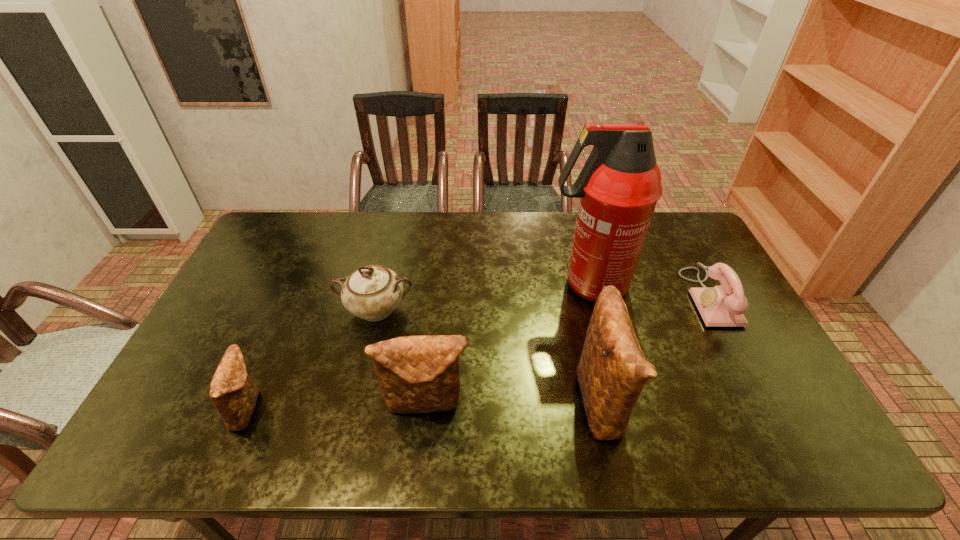
Image resolution: width=960 pixels, height=540 pixels. Find the location of `the leftmost clutch bag`. the leftmost clutch bag is located at coordinates (234, 394).

This screenshot has width=960, height=540. I want to click on the shortest clutch bag, so click(234, 394).

Find the location of a particular element. The width and height of the screenshot is (960, 540). the fourth shortest object is located at coordinates (417, 374).

In order to click on the second clutch bag from left to right in this screenshot , I will do point(417,374).

Where is `the rightmost clutch bag`? the rightmost clutch bag is located at coordinates (612, 371).

This screenshot has height=540, width=960. I want to click on the tallest object, so click(x=619, y=185).

The height and width of the screenshot is (540, 960). I want to click on chinaware, so click(372, 292).

At what (x,y) coordinates should I click in order to perform the action: click on telephone. Please return your answer as a coordinate pair (x, y). Looking at the image, I should click on (722, 306).

Locate an element on the screen. vacant space situated 0.270m on the open side of the leftmost object is located at coordinates (372, 408).

Find the location of `free space located 0.140m on the open side of the rightmost clutch bag`. free space located 0.140m on the open side of the rightmost clutch bag is located at coordinates (682, 399).